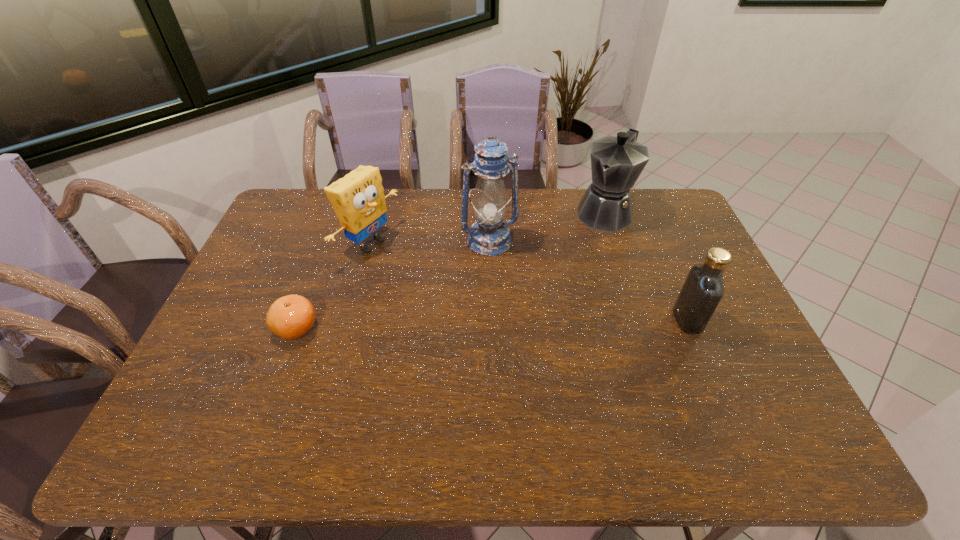
The image size is (960, 540). I want to click on coffeepot that is positioned at the far edge, so [x=616, y=162].

At what (x,y) coordinates should I click in order to perform the action: click on object that is positioned at the left edge. Please return your answer as a coordinate pair (x, y). Image resolution: width=960 pixels, height=540 pixels. Looking at the image, I should click on (289, 317).

The image size is (960, 540). I want to click on object that is positioned at the right edge, so click(x=703, y=288).

Locate an element on the screen. The height and width of the screenshot is (540, 960). free space at the far edge of the desktop is located at coordinates 575,192.

In the image, there is a desktop. At what (x,y) coordinates should I click in order to perform the action: click on blank space at the far left corner. Please return your answer as a coordinate pair (x, y). The width and height of the screenshot is (960, 540). Looking at the image, I should click on (321, 208).

Find the location of a particular element. Image resolution: width=960 pixels, height=540 pixels. free space at the far right corner of the desktop is located at coordinates pos(636,199).

Locate an element on the screen. The height and width of the screenshot is (540, 960). free point between the sponge and the shortest object is located at coordinates (333, 286).

Locate an element on the screen. Image resolution: width=960 pixels, height=540 pixels. free space between the shortest object and the vodka is located at coordinates (492, 324).

Find the location of `vacant space that is in between the vodka and the third object from left to right`. vacant space that is in between the vodka and the third object from left to right is located at coordinates (588, 280).

Identify the location of empty space between the vodka and the second tallest object. This screenshot has height=540, width=960. (645, 266).